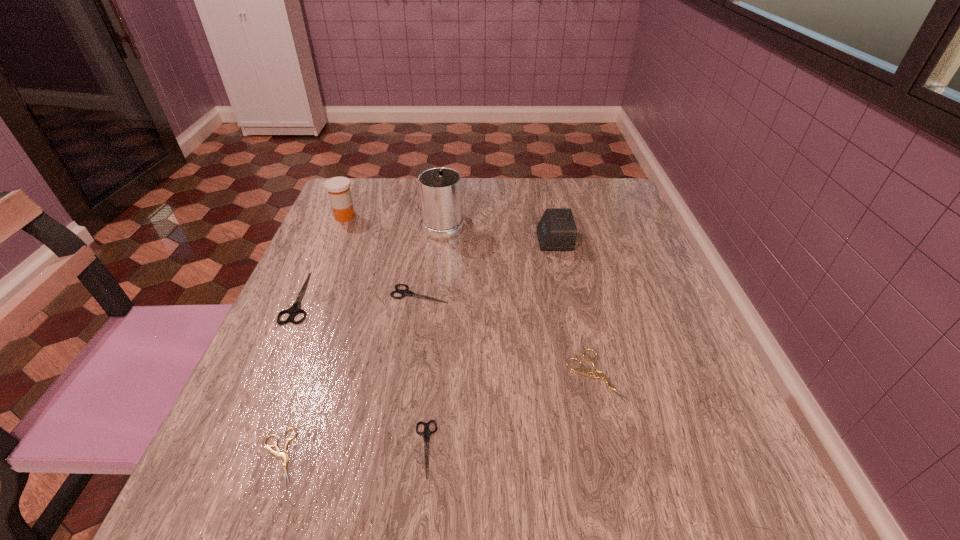
The width and height of the screenshot is (960, 540). I want to click on black shears that is the closest to the farther beige shears, so click(x=426, y=433).

Locate an element on the screen. black shears that is the closest one to the gray mug is located at coordinates (406, 292).

Where is `free location that satisfies the following two spatial constraints: 1. on the label of the orange medicine; 2. on the right side of the nearest black shears`? The image size is (960, 540). free location that satisfies the following two spatial constraints: 1. on the label of the orange medicine; 2. on the right side of the nearest black shears is located at coordinates (248, 449).

Identify the location of blank area in the image that satisfies the following two spatial constraints: 1. on the label of the orange medicine; 2. on the right side of the bigger beige shears. (278, 375).

You are a GUI agent. You are given a task and a screenshot of the screen. Output one action in this format:
    pyautogui.click(x=<x>, y=<y>)
    Task: Click on the vacant space that satisfies the following two spatial constraints: 1. on the label of the orange medicine; 2. on the back side of the smallest black shears
    Image resolution: width=960 pixels, height=540 pixels.
    Given the screenshot: What is the action you would take?
    pyautogui.click(x=248, y=449)